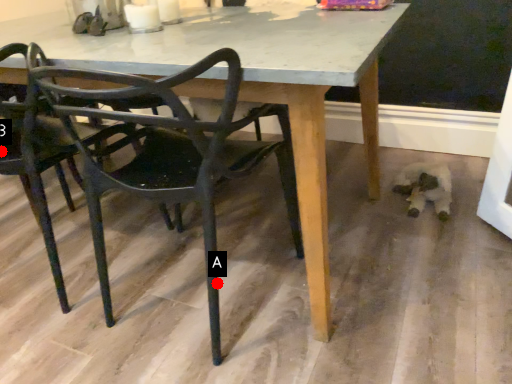
Question: Two points are circled on the image, labeled by A and B beside each circle. Which point appears farthest from the camera in this image?

Choices:
 (A) A is further
 (B) B is further

Answer: (B)